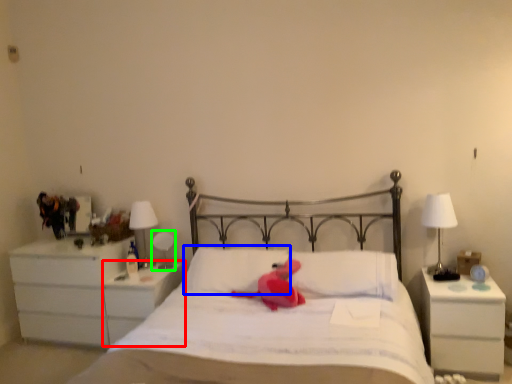
Question: Considering the real-world distances, which object is closest to nightstand (highlighted by a red box)? pillow (highlighted by a blue box) or table lamp (highlighted by a green box).

Choices:
 (A) pillow
 (B) table lamp

Answer: (B)